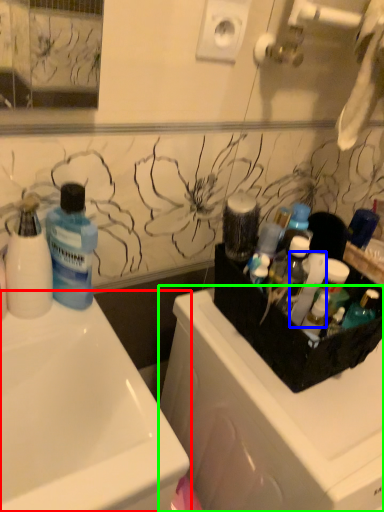
Question: Which object is the farthest from sink (highlighted by a red box)? Choose among these: cleaning product (highlighted by a blue box) or dish washer (highlighted by a green box).

Choices:
 (A) cleaning product
 (B) dish washer

Answer: (A)